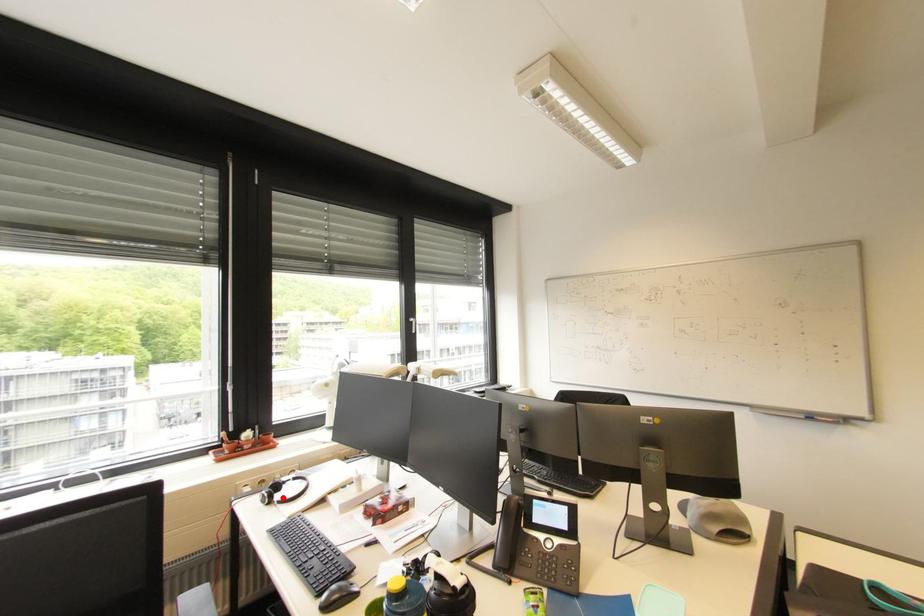
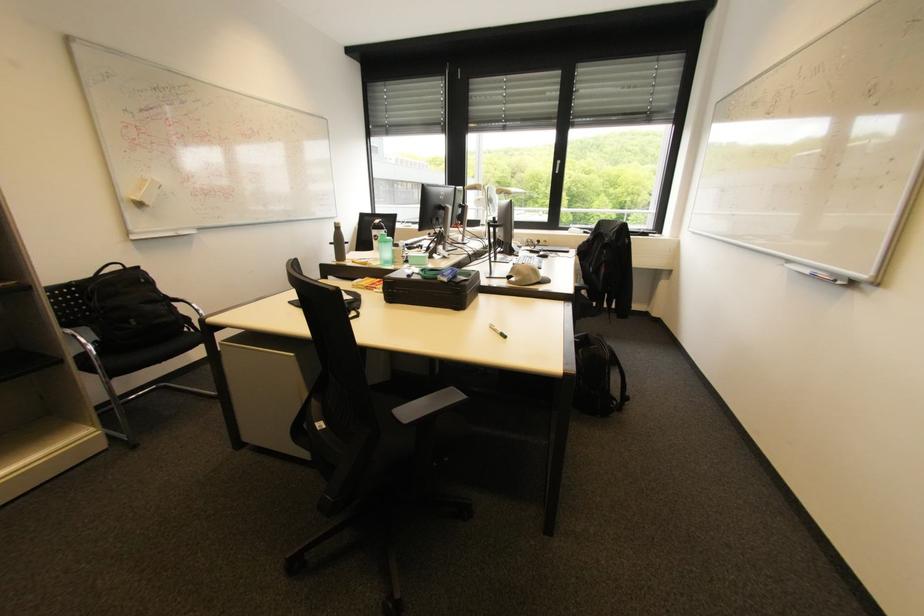
Question: I am providing you with two images of the same scene from different viewpoints. A red point is marked on the first image. Is the red point's position out of view in image 2?

Choices:
 (A) Yes
 (B) No

Answer: (A)